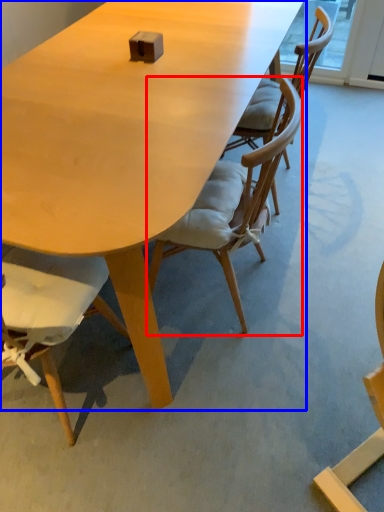
Question: Which object appears farthest to the camera in this image, chair (highlighted by a red box) or table (highlighted by a blue box)?

Choices:
 (A) chair
 (B) table

Answer: (A)